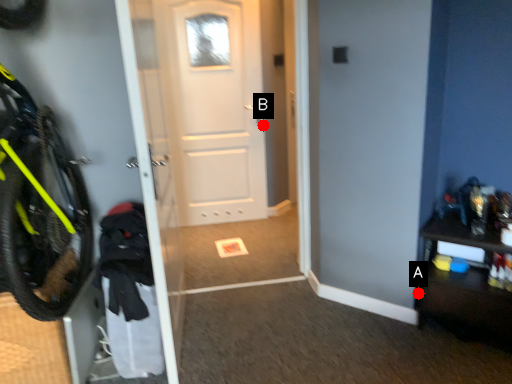
Question: Two points are circled on the image, labeled by A and B beside each circle. Which point appears farthest from the camera in this image?

Choices:
 (A) A is further
 (B) B is further

Answer: (B)